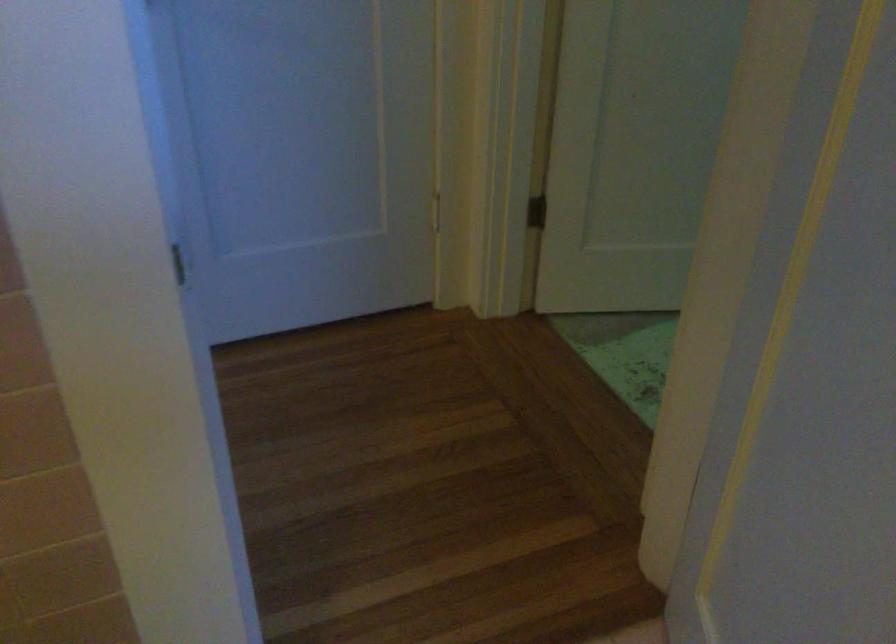
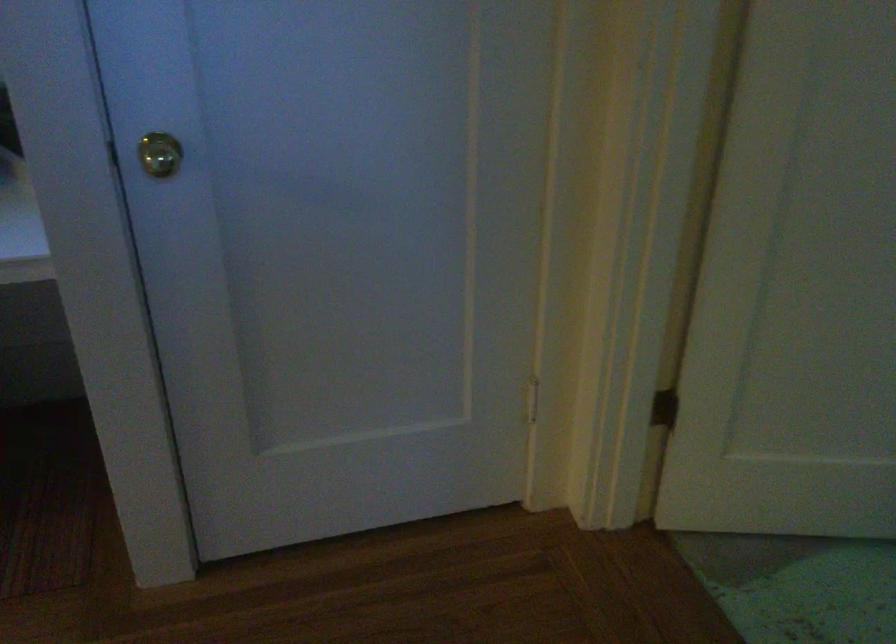
Question: The camera is either moving clockwise (left) or counter-clockwise (right) around the object. The first image is from the beginning of the video and the second image is from the end. Is the camera moving left or right when shooting the video?

Choices:
 (A) Left
 (B) Right

Answer: (B)